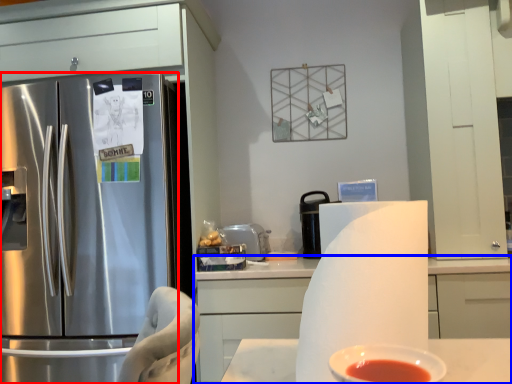
Question: Which point is further to the camera, refrigerator (highlighted by a red box) or cabinetry (highlighted by a blue box)?

Choices:
 (A) refrigerator
 (B) cabinetry

Answer: (A)